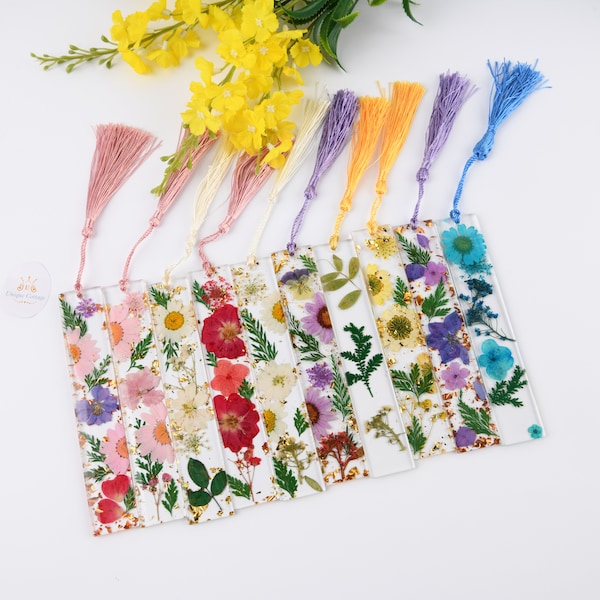
What are the coordinates of `yellow tassel` in the screenshot? It's located at (355, 127), (370, 133), (355, 169), (387, 134), (396, 135), (385, 162).